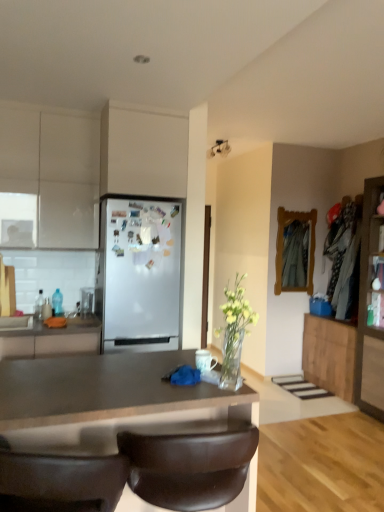
Question: From the image's perspective, relative to wooden cabinet at right, which is the 2th cabinetry from right to left, is brown leather chair at lower center above or below?

Choices:
 (A) below
 (B) above

Answer: (B)

Question: From a real-world perspective, is brown leather chair at lower center physically located above or below wooden cabinet at right, which is the 2th cabinetry from right to left?

Choices:
 (A) above
 (B) below

Answer: (A)

Question: Which object is positioned farthest from the white matte cabinet at upper left, the 5th cabinetry when ordered from right to left?

Choices:
 (A) wooden cabinet at right, acting as the 4th cabinetry starting from the left
 (B) brown leather chair at lower center
 (C) wooden cabinet at right, the fifth cabinetry positioned from the left
 (D) matte white cabinet at upper center, acting as the 3th cabinetry starting from the right
 (E) matte white countertop at left, which is the 4th cabinetry in right-to-left order

Answer: (A)

Question: Considering the real-world distances, which object is farthest from the matte white cabinet at upper center, acting as the 3th cabinetry starting from the right?

Choices:
 (A) white matte refrigerator at center
 (B) brown leather chair at lower center
 (C) wooden cabinet at right, which is the 2th cabinetry from right to left
 (D) white matte cabinet at upper left, marked as the first cabinetry in a left-to-right arrangement
 (E) matte brown countertop at center

Answer: (C)